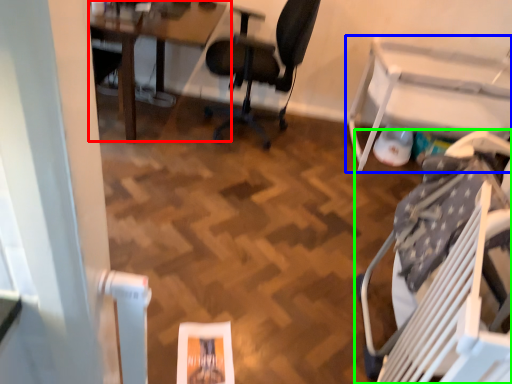
Question: Which object is positioned closest to table (highlighted by a red box)? Select from table (highlighted by a blue box) and chair (highlighted by a green box).

Choices:
 (A) table
 (B) chair

Answer: (A)